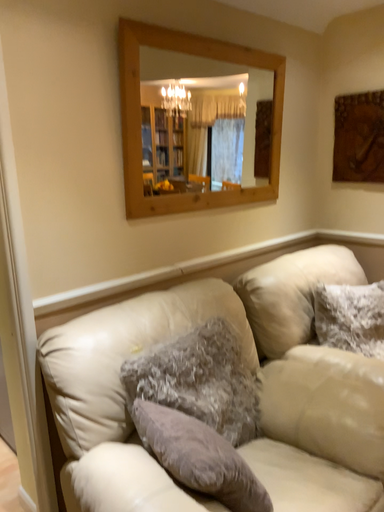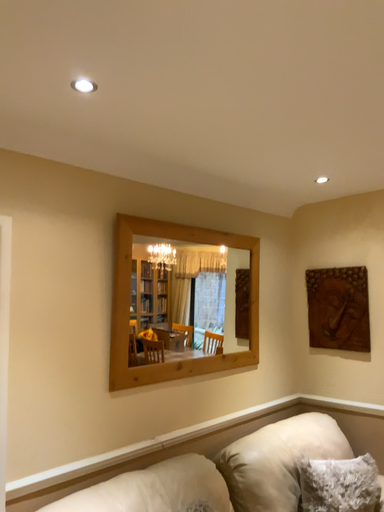
Question: Which way did the camera rotate in the video?

Choices:
 (A) rotated downward
 (B) rotated upward

Answer: (B)